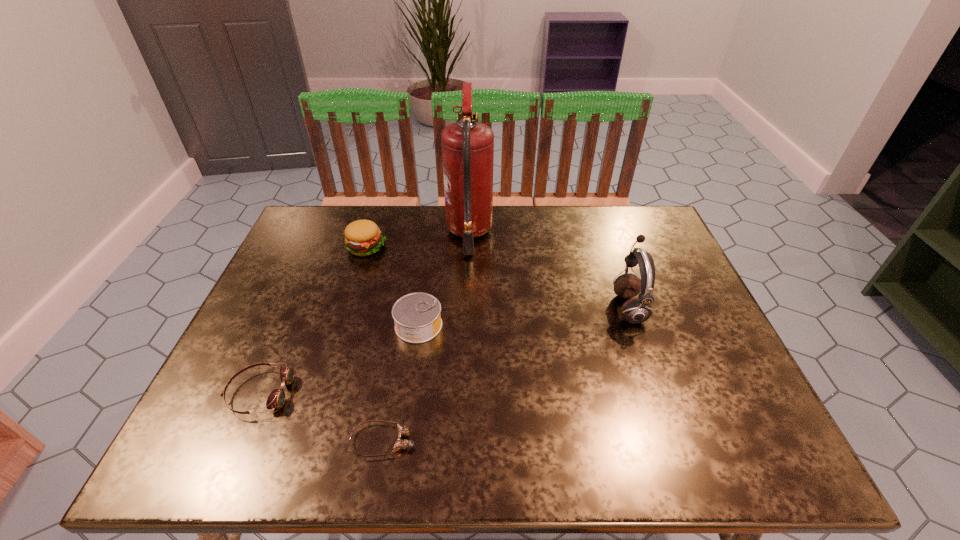
Identify the location of free area in between the can and the nearest object. (401, 383).

Image resolution: width=960 pixels, height=540 pixels. I want to click on free space between the can and the rightmost object, so click(523, 316).

You are a GUI agent. You are given a task and a screenshot of the screen. Output one action in this format:
    pyautogui.click(x=<x>, y=<y>)
    Task: Click on the free point between the third shortest object and the fifth object from right to left
    Image resolution: width=960 pixels, height=540 pixels.
    Given the screenshot: What is the action you would take?
    pyautogui.click(x=392, y=287)

Where is `free point between the nearer goggles and the second tallest object`? The image size is (960, 540). free point between the nearer goggles and the second tallest object is located at coordinates (506, 374).

This screenshot has width=960, height=540. Identify the location of vacant space in between the tallest object and the fifth object from right to left. (418, 240).

I want to click on vacant space that is in between the fifth farthest object and the nearest object, so 322,417.

Locate an element on the screen. The width and height of the screenshot is (960, 540). vacant area that lies between the third tallest object and the second tallest object is located at coordinates (497, 277).

Image resolution: width=960 pixels, height=540 pixels. Find the location of `vacant space that's between the earphone and the left goggles`. vacant space that's between the earphone and the left goggles is located at coordinates (444, 350).

The width and height of the screenshot is (960, 540). Find the location of `free space between the nearest object and the second object from left to right`. free space between the nearest object and the second object from left to right is located at coordinates (374, 344).

Identify the location of free point between the rightmost object and the taller goggles. Image resolution: width=960 pixels, height=540 pixels. (444, 350).